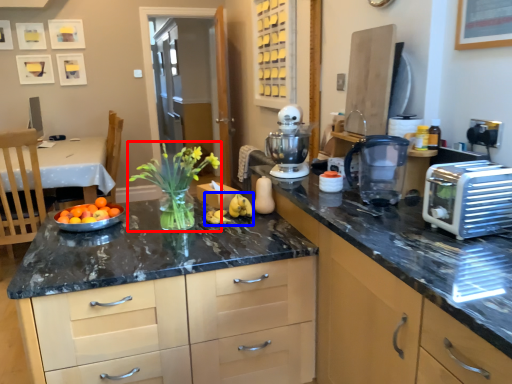
Question: Which object is further to the camera taking this photo, floral arrangement (highlighted by a red box) or banana (highlighted by a blue box)?

Choices:
 (A) floral arrangement
 (B) banana

Answer: (B)